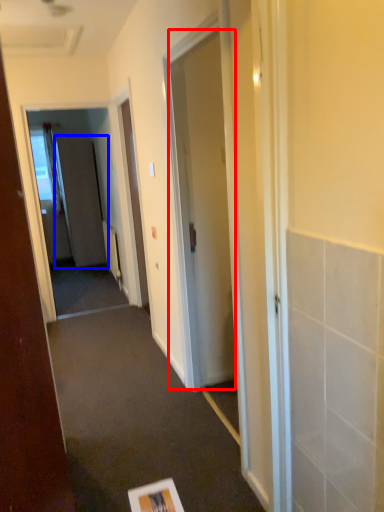
Question: Which of the following is the farthest to the observer, door (highlighted by a red box) or screen door (highlighted by a blue box)?

Choices:
 (A) door
 (B) screen door

Answer: (B)